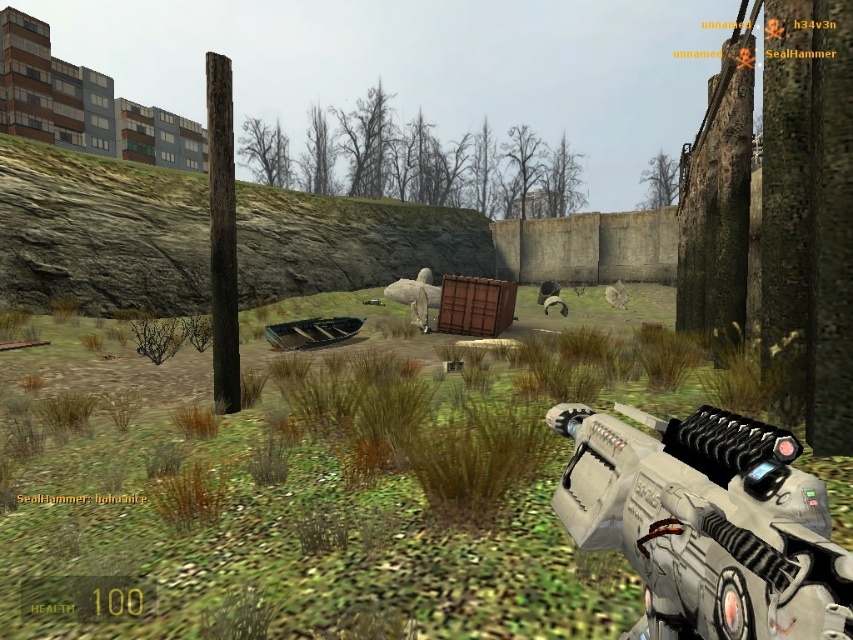
You are playing a first person shooter game and see a point at coordinate (706, 524). What object is located at that point?

The metallic silver gun at lower right is located at point (706, 524).

You are a player in the game and need to determine if your metallic silver gun at lower right can be hidden behind the furry gray animal at center without being seen. Based on their sizes, is this possible?

The metallic silver gun at lower right is smaller than the furry gray animal at center, so it can be hidden behind the furry gray animal at center without being seen.